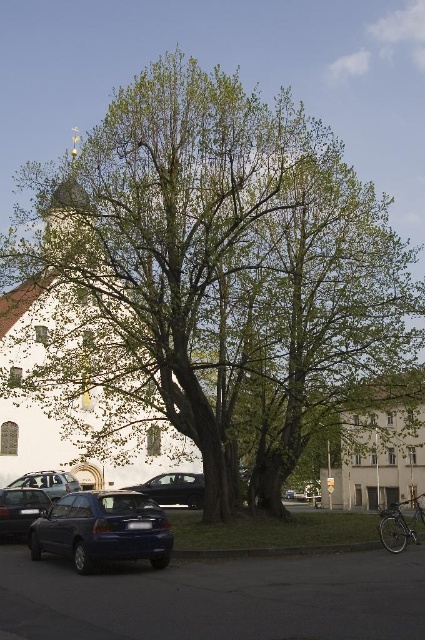
Question: Among these points, which one is nearest to the camera?

Choices:
 (A) (294, 493)
 (B) (388, 484)
 (C) (153, 554)

Answer: (C)

Question: Which of the following is the farthest from the observer?

Choices:
 (A) white concrete building at center
 (B) metallic silver car at lower left
 (C) shiny black sedan at center
 (D) matte black car at lower left

Answer: (B)

Question: Can you confirm if matte blue hatchback at lower left is positioned below matte black car at lower left?

Choices:
 (A) no
 (B) yes

Answer: (A)

Question: Is white stone church at center smaller than metallic silver car at lower left?

Choices:
 (A) no
 (B) yes

Answer: (A)

Question: Which point is closer to the camera?

Choices:
 (A) (87, 390)
 (B) (416, 476)

Answer: (A)

Question: Does white stone church at center appear under shiny black sedan at center?

Choices:
 (A) yes
 (B) no

Answer: (B)